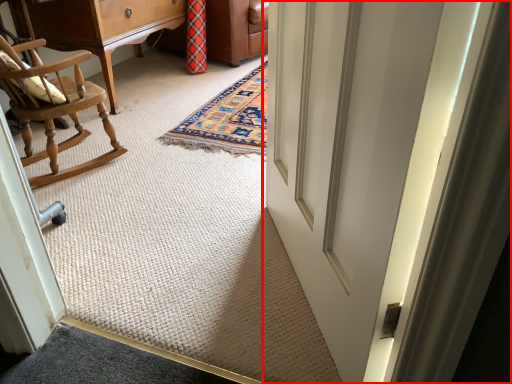
Question: From the image's perspective, what is the correct spatial positioning of door (annotated by the red box) in reference to furniture?

Choices:
 (A) below
 (B) above

Answer: (A)